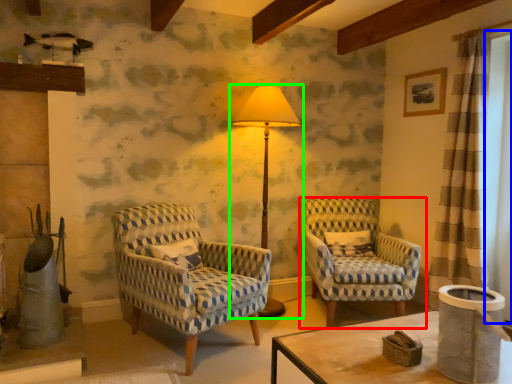
Question: Which object is the farthest from chair (highlighted by a red box)? Choose among these: window screen (highlighted by a blue box) or lamp (highlighted by a green box).

Choices:
 (A) window screen
 (B) lamp

Answer: (A)